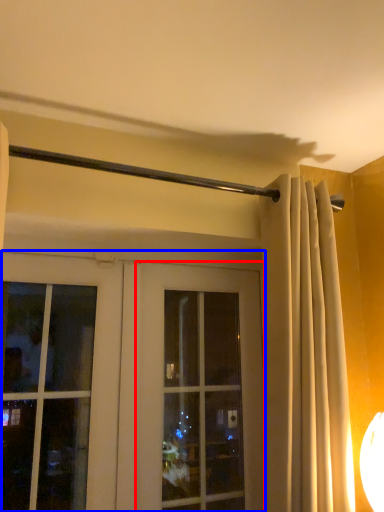
Question: Which object is further to the camera taking this photo, window (highlighted by a red box) or door (highlighted by a blue box)?

Choices:
 (A) window
 (B) door

Answer: (A)